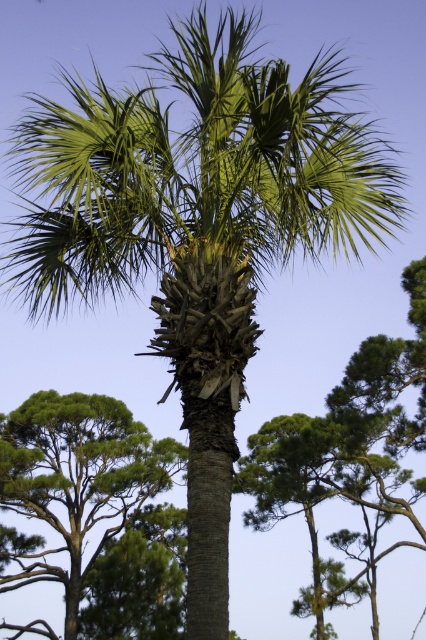
Is point (273, 508) in front of point (155, 440)?

Yes, it is.

Is green leafy palm at center positioned at the back of green leafy tree at lower left?

No, green leafy palm at center is closer to the viewer.

Describe the element at coordinates (348, 445) in the screenshot. I see `green leafy palm at center` at that location.

This screenshot has width=426, height=640. Identify the location of green leafy palm at center. coord(348,445).